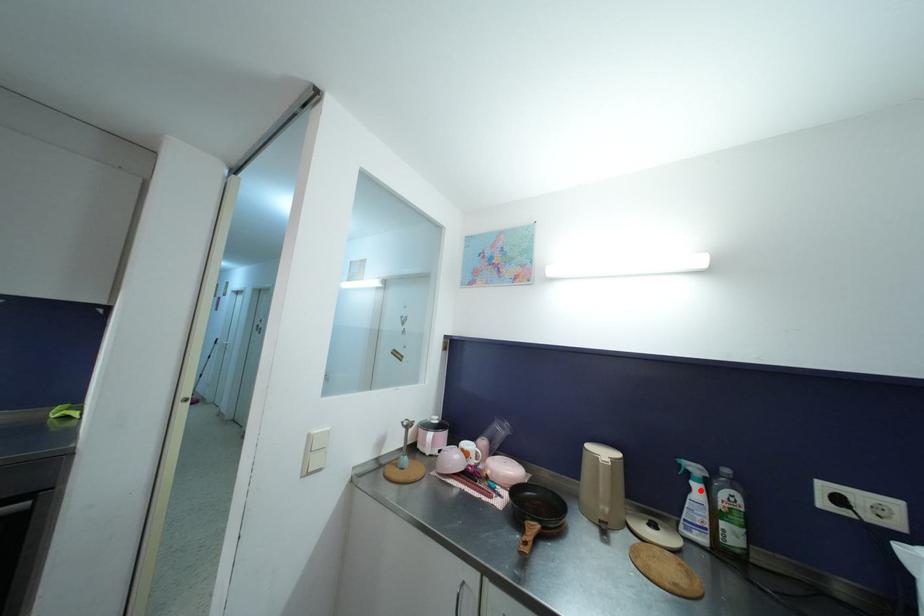
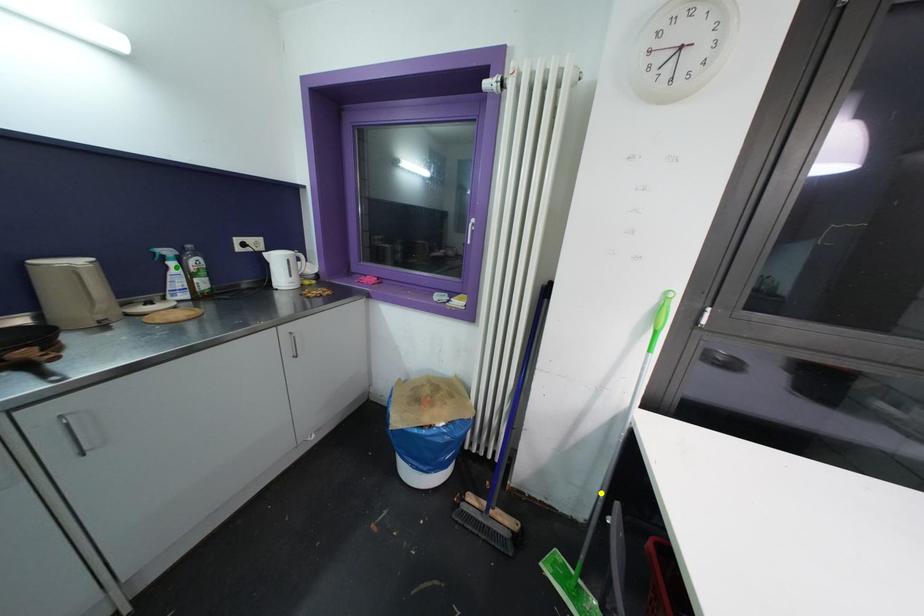
Question: I am providing you with two images of the same scene from different viewpoints. A red point is marked on the first image. You are given multiple points on the second image. Which spot in image 2 lines up with the point in image 1?

Choices:
 (A) blue point
 (B) green point
 (C) yellow point

Answer: (B)